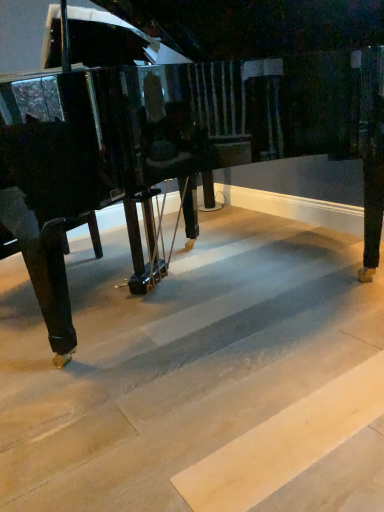
Locate an element on the screen. This screenshot has width=384, height=512. vacant area situated below glossy black piano at center (from a real-world perspective) is located at coordinates (200, 302).